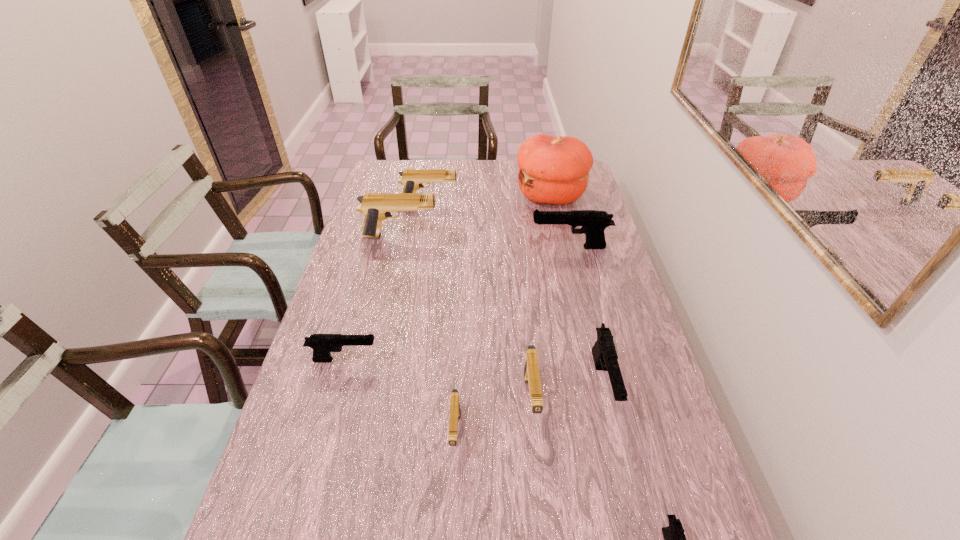
Identify the location of the tallest object. (554, 170).

Find the location of a particular element. the second farthest pistol is located at coordinates (376, 207).

Locate an element on the screen. the second farthest tan pistol is located at coordinates coord(376,207).

At what (x,y) coordinates should I click in order to perform the action: click on the sixth nearest object. Please return your answer as a coordinate pair (x, y). This screenshot has width=960, height=540. Looking at the image, I should click on (593, 222).

Where is `the third farthest pistol`? The width and height of the screenshot is (960, 540). the third farthest pistol is located at coordinates (593, 222).

Locate an element on the screen. the farthest tan pistol is located at coordinates (412, 179).

Locate an element on the screen. The image size is (960, 540). the second biggest tan pistol is located at coordinates (412, 179).

The height and width of the screenshot is (540, 960). Identify the location of the third smallest black pistol. (604, 354).

Locate an element on the screen. Image resolution: width=960 pixels, height=540 pixels. the fifth object from right to left is located at coordinates (531, 367).

You are a GUI agent. You are given a task and a screenshot of the screen. Output one action in this format:
    pyautogui.click(x=<x>, y=<y>)
    Task: Click on the fourth pistol from right to left
    The image size is (960, 540).
    Given the screenshot: What is the action you would take?
    pyautogui.click(x=531, y=367)